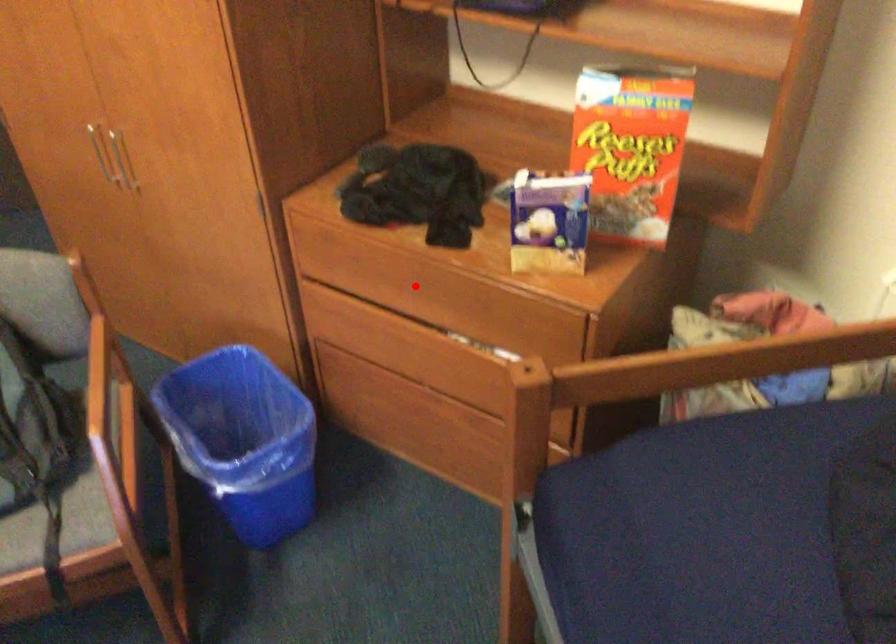
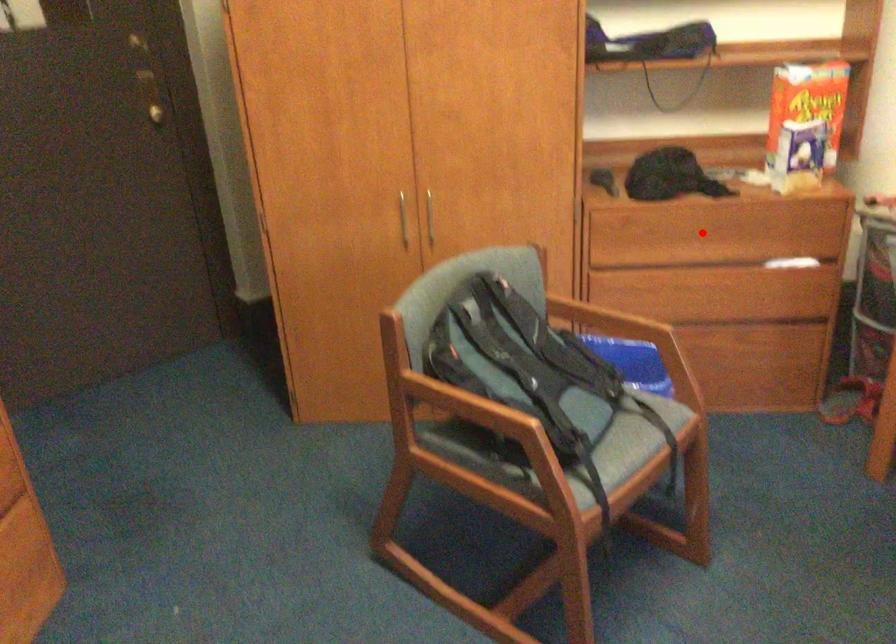
I am providing you with two images of the same scene from different viewpoints. A red point is marked on the first image and another point is marked on the second image. Does the point marked in image1 correspond to the same location as the one in image2?

Yes